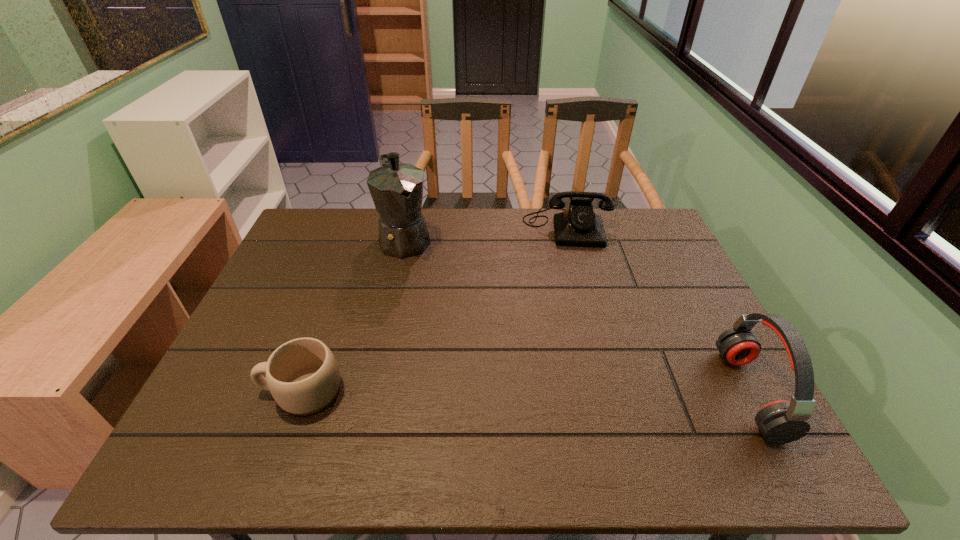
Identify the location of free space on the desktop that is between the mug and the rightmost object and is positioned on the front face of the second object from right to left. This screenshot has width=960, height=540. (x=589, y=393).

I want to click on vacant spot on the desktop that is between the mug and the rightmost object and is positioned on the pouring side of the tallest object, so pyautogui.click(x=487, y=392).